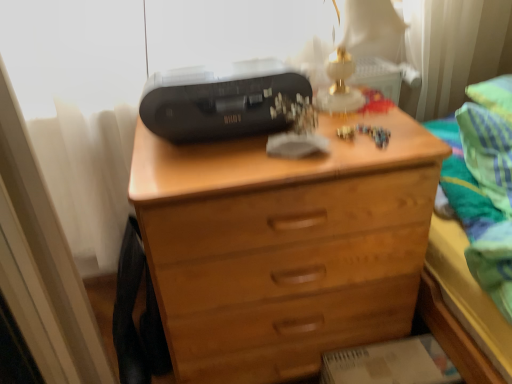
Question: Should I look upward or downward to see green striped fabric at upper right?

Choices:
 (A) up
 (B) down

Answer: (A)

Question: Does green striped fabric at upper right have a smaller size compared to black plastic printer at upper center?

Choices:
 (A) yes
 (B) no

Answer: (B)

Question: Is green striped fabric at upper right thinner than black plastic printer at upper center?

Choices:
 (A) no
 (B) yes

Answer: (A)

Question: Is green striped fabric at upper right with black plastic printer at upper center?

Choices:
 (A) yes
 (B) no

Answer: (B)

Question: From the image's perspective, is green striped fabric at upper right above black plastic printer at upper center?

Choices:
 (A) yes
 (B) no

Answer: (B)

Question: Does green striped fabric at upper right have a lesser height compared to black plastic printer at upper center?

Choices:
 (A) yes
 (B) no

Answer: (B)

Question: Can you confirm if green striped fabric at upper right is wider than black plastic printer at upper center?

Choices:
 (A) yes
 (B) no

Answer: (A)

Question: Is green striped fabric at upper right taller than wooden chest of drawers at center?

Choices:
 (A) yes
 (B) no

Answer: (B)

Question: Is green striped fabric at upper right facing towards wooden chest of drawers at center?

Choices:
 (A) yes
 (B) no

Answer: (B)

Question: Considering the relative positions of green striped fabric at upper right and wooden chest of drawers at center in the image provided, is green striped fabric at upper right to the left of wooden chest of drawers at center from the viewer's perspective?

Choices:
 (A) no
 (B) yes

Answer: (A)

Question: Is green striped fabric at upper right behind wooden chest of drawers at center?

Choices:
 (A) no
 (B) yes

Answer: (B)

Question: Considering the relative sizes of green striped fabric at upper right and wooden chest of drawers at center in the image provided, is green striped fabric at upper right smaller than wooden chest of drawers at center?

Choices:
 (A) yes
 (B) no

Answer: (A)

Question: From the image's perspective, is green striped fabric at upper right beneath wooden chest of drawers at center?

Choices:
 (A) no
 (B) yes

Answer: (A)

Question: Are wooden chest of drawers at center and black plastic printer at upper center located far from each other?

Choices:
 (A) no
 (B) yes

Answer: (A)